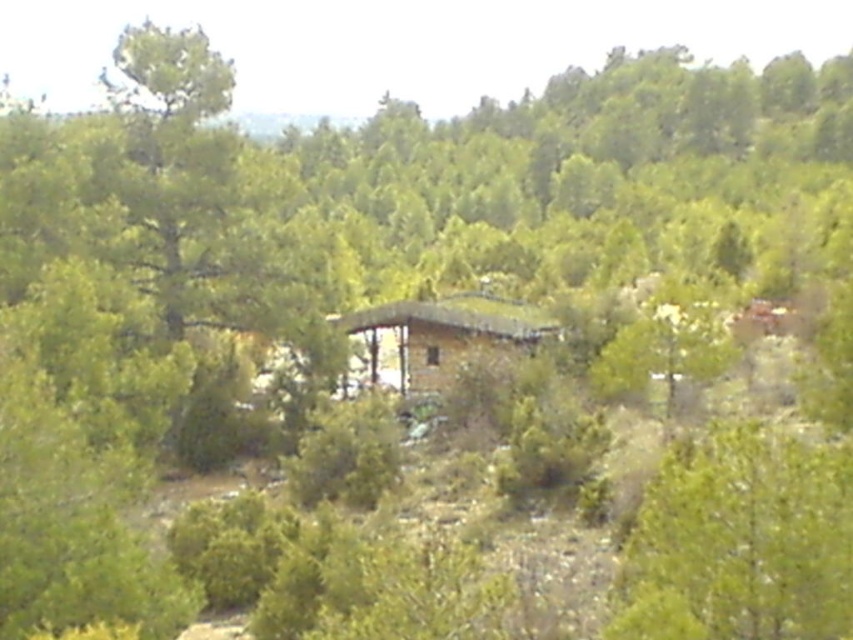
Question: Which point is closer to the camera taking this photo?

Choices:
 (A) 450,342
 (B) 837,573

Answer: (B)

Question: Can you confirm if green leafy tree at lower right is thinner than wooden cabin at center?

Choices:
 (A) yes
 (B) no

Answer: (A)

Question: Is green leafy tree at lower right wider than wooden cabin at center?

Choices:
 (A) no
 (B) yes

Answer: (A)

Question: Is green leafy tree at lower right wider than wooden cabin at center?

Choices:
 (A) yes
 (B) no

Answer: (B)

Question: Which point is closer to the camera?

Choices:
 (A) (792, 548)
 (B) (428, 356)

Answer: (A)